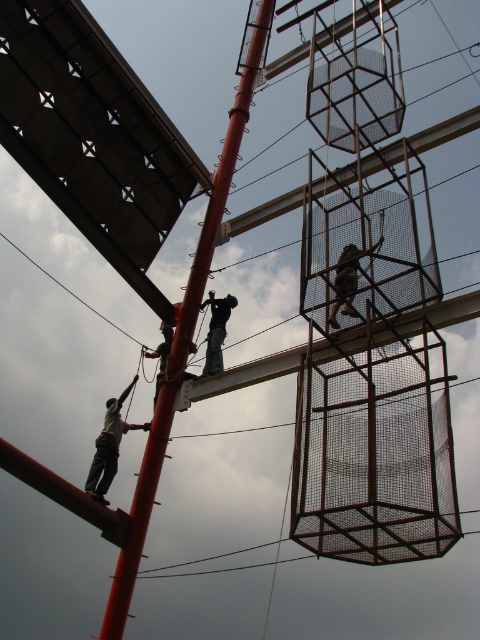
Which is below, smooth red pole at center or yellow safety harness at center?

yellow safety harness at center

Is point (151, 426) positioned behind point (354, 246)?

Yes, point (151, 426) is farther from viewer.

Identify the location of smooth red pole at center. The width and height of the screenshot is (480, 640). (187, 321).

Who is more forward, [352,262] or [217,308]?

Point [352,262]

How much distance is there between yellow safety harness at center and dark blue jeans at center?

yellow safety harness at center and dark blue jeans at center are 13.62 meters apart from each other.

Identify the location of yellow safety harness at center. (348, 280).

Is smooth red pole at center bigger than green fabric rope at left?

Correct, smooth red pole at center is larger in size than green fabric rope at left.

Can you confirm if smooth red pole at center is positioned above green fabric rope at left?

Yes.

This screenshot has height=640, width=480. What are the coordinates of `smooth red pole at center` in the screenshot? It's located at (187, 321).

This screenshot has height=640, width=480. In order to click on smooth red pole at center in this screenshot , I will do pyautogui.click(x=187, y=321).